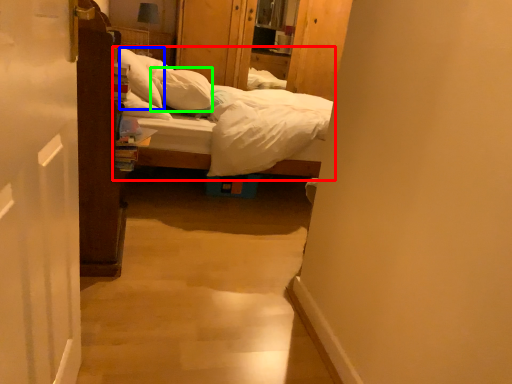
Question: Which object is positioned farthest from bed (highlighted by a red box)? Select from pillow (highlighted by a blue box) and pillow (highlighted by a green box).

Choices:
 (A) pillow
 (B) pillow

Answer: (B)